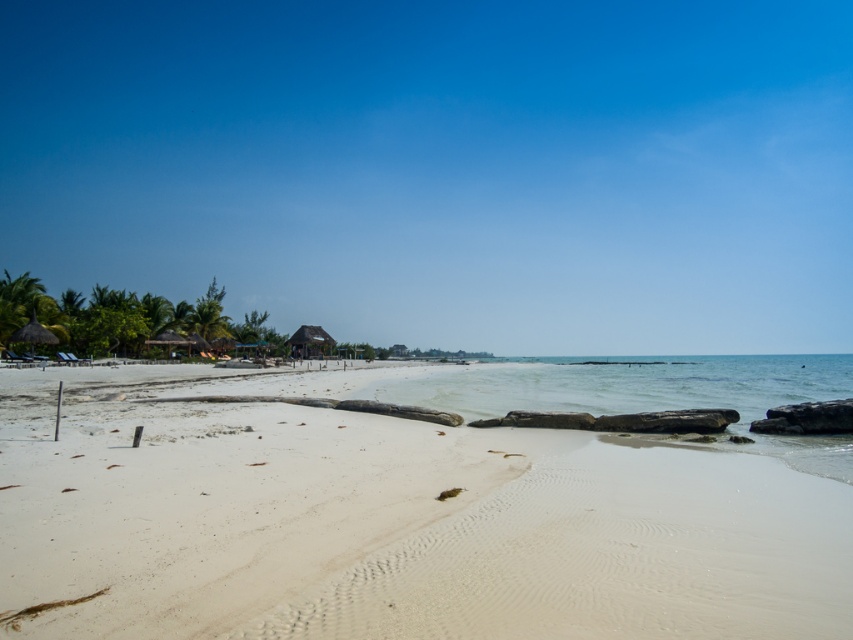
Question: Does clear water at lower right lie in front of thatched roof hut at center?

Choices:
 (A) yes
 (B) no

Answer: (A)

Question: Can you confirm if white sand beach at center is positioned to the right of thatched roof hut at center?

Choices:
 (A) yes
 (B) no

Answer: (A)

Question: Which point is farther to the camera?

Choices:
 (A) (647, 570)
 (B) (328, 352)

Answer: (B)

Question: Observing the image, what is the correct spatial positioning of white sand beach at center in reference to thatched roof hut at center?

Choices:
 (A) left
 (B) right

Answer: (B)

Question: Which point is closer to the camera?

Choices:
 (A) (494, 378)
 (B) (331, 442)

Answer: (B)

Question: Which is farther from the white sand beach at center?

Choices:
 (A) thatched roof hut at center
 (B) clear water at lower right

Answer: (A)